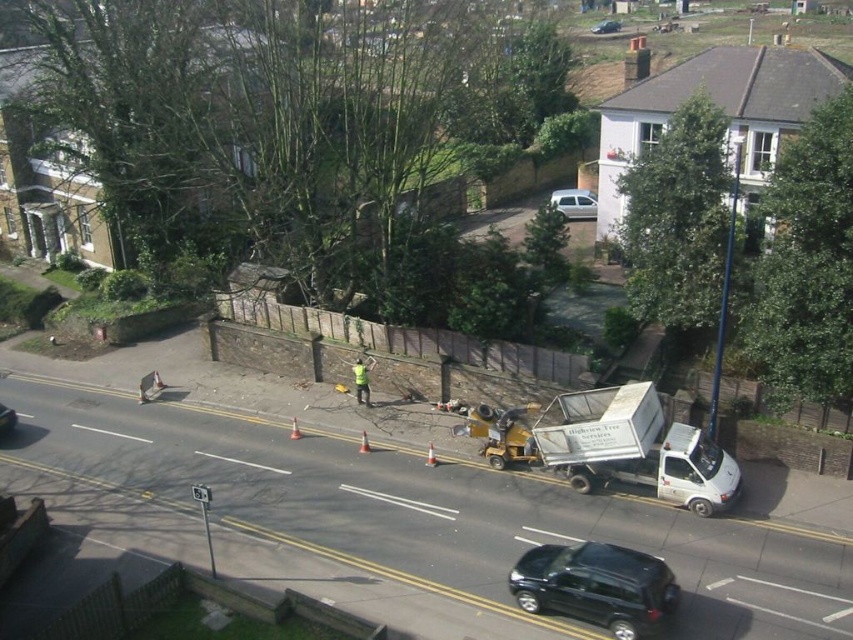
Who is more forward, (563, 580) or (4, 410)?

Point (563, 580)

Is shiny black suv at lower center behind black glossy car at left?

No, it is not.

Who is more distant from viewer, (621, 636) or (13, 417)?

The point (13, 417) is behind.

The width and height of the screenshot is (853, 640). Find the location of `shiny black suv at lower center`. shiny black suv at lower center is located at coordinates (595, 586).

This screenshot has width=853, height=640. Find the location of `white matte truck at right`. white matte truck at right is located at coordinates (635, 448).

Is point (672, 465) farther from camera compared to point (659, 566)?

Yes, point (672, 465) is behind point (659, 566).

Identify the location of white matte truck at right. Image resolution: width=853 pixels, height=640 pixels. (635, 448).

Does shiny black suv at lower center come behind metallic silver car at center?

No, shiny black suv at lower center is in front of metallic silver car at center.

Which of these two, shiny black suv at lower center or metallic silver car at center, stands shorter?

shiny black suv at lower center is shorter.

Does point (614, 557) come in front of point (619, 24)?

Yes, point (614, 557) is closer to viewer.

Where is `shiny black suv at lower center`? shiny black suv at lower center is located at coordinates (595, 586).